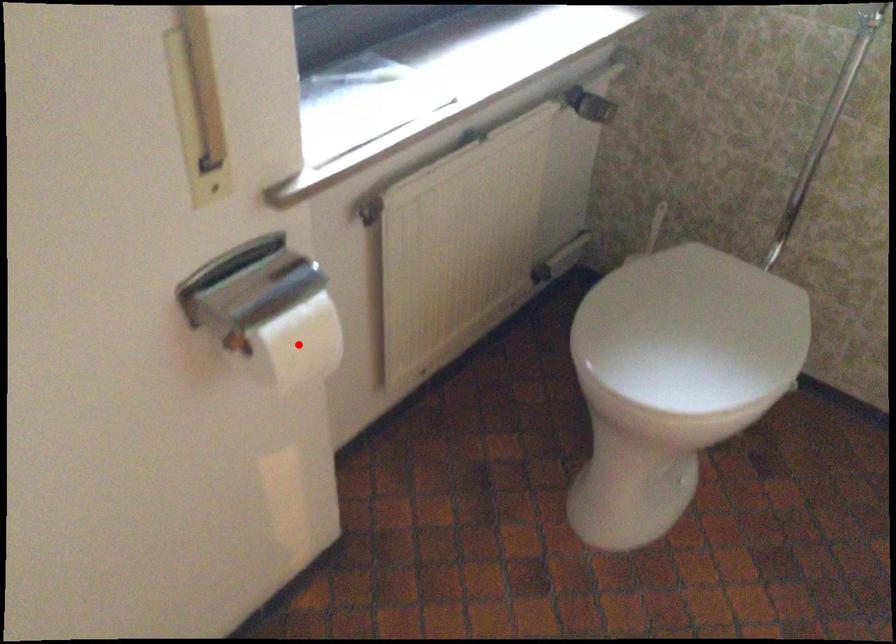
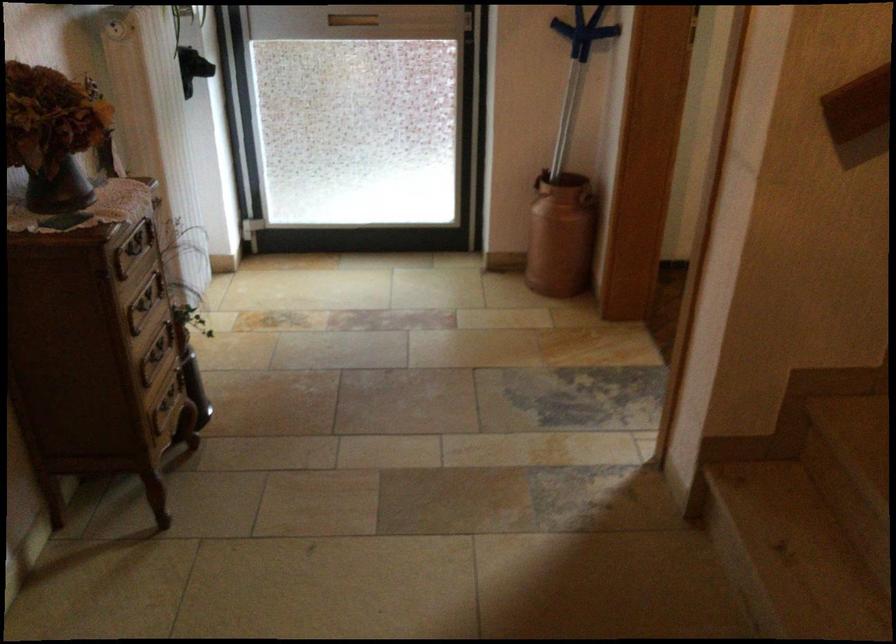
Question: I am providing you with two images of the same scene from different viewpoints. A red point is marked on the first image. Can you still see the location of the red point in image 2?

Choices:
 (A) Yes
 (B) No

Answer: (B)